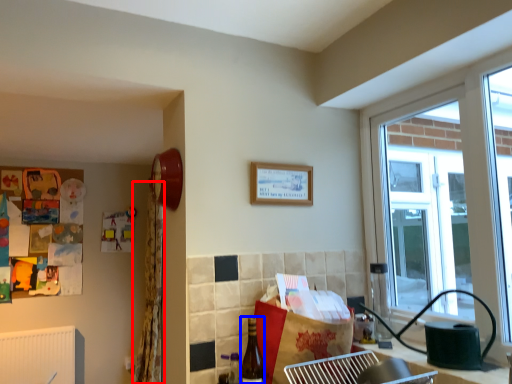
Question: Which object appears closest to the camera in this image, curtain (highlighted by a red box) or bottle (highlighted by a blue box)?

Choices:
 (A) curtain
 (B) bottle

Answer: (B)